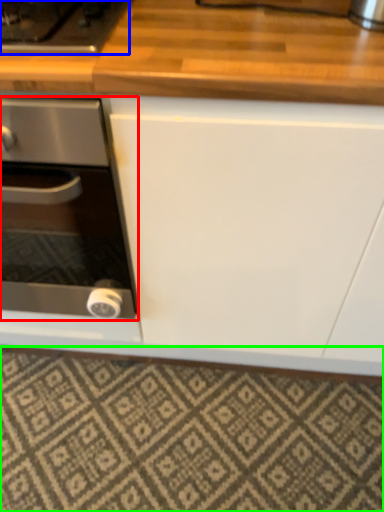
Question: Which object is the farthest from kitchen appliance (highlighted by a red box)? Choose among these: gas stove (highlighted by a blue box) or tile (highlighted by a green box).

Choices:
 (A) gas stove
 (B) tile

Answer: (B)